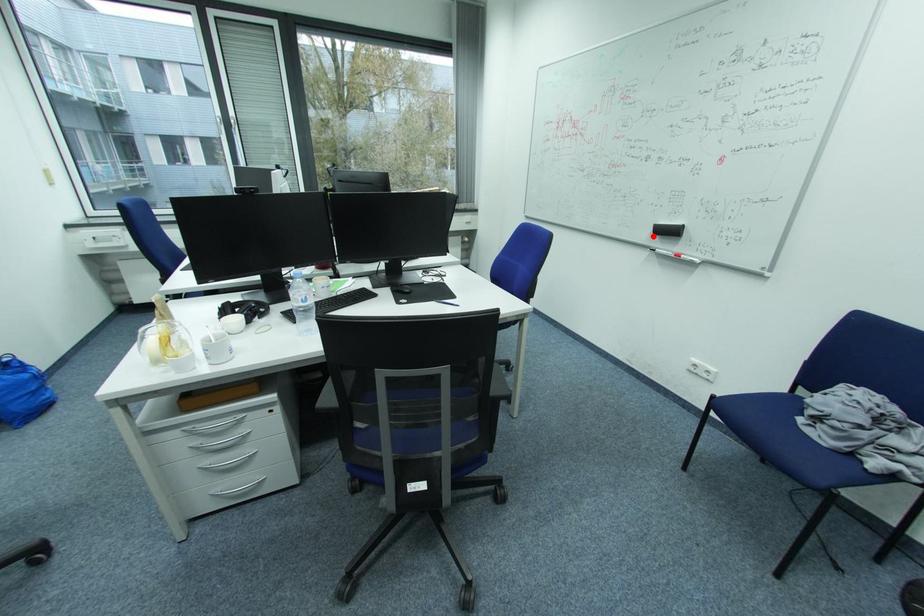
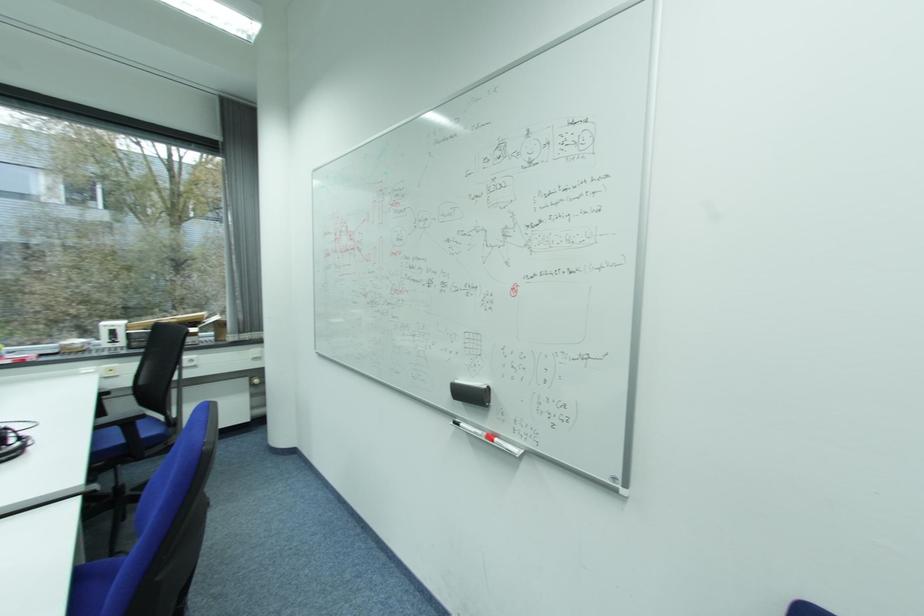
The point at the highlighted location is marked in the first image. Where is the corresponding point in the second image?

(453, 398)